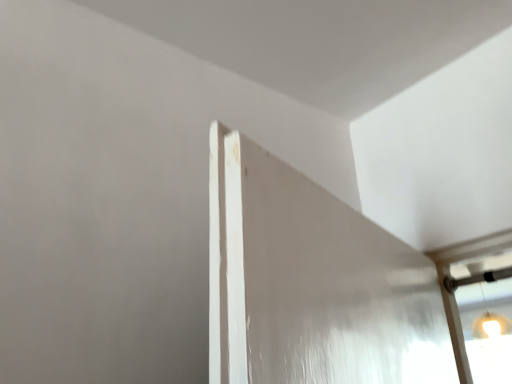
Image resolution: width=512 pixels, height=384 pixels. Find the location of `matte glass light fixture at upper right`. matte glass light fixture at upper right is located at coordinates (490, 323).

What do you see at coordinates (490, 323) in the screenshot? This screenshot has width=512, height=384. I see `matte glass light fixture at upper right` at bounding box center [490, 323].

Identify the location of matte glass light fixture at upper right. (490, 323).